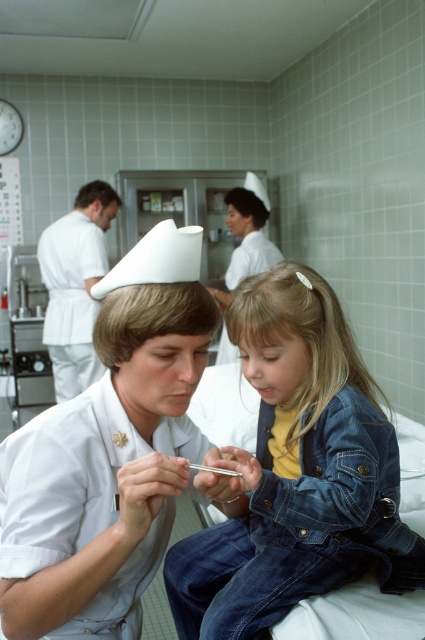
Question: Is denim jacket at lower right thinner than white uniform at center?

Choices:
 (A) no
 (B) yes

Answer: (B)

Question: Is faded denim jacket at lower right to the left of white uniform at center from the viewer's perspective?

Choices:
 (A) no
 (B) yes

Answer: (A)

Question: Is denim jacket at lower right positioned in front of white uniform at center?

Choices:
 (A) no
 (B) yes

Answer: (B)

Question: Considering the real-world distances, which object is closest to the white uniform at center?

Choices:
 (A) denim jacket at lower right
 (B) faded denim jacket at lower right

Answer: (B)

Question: Which is nearer to the denim jacket at lower right?

Choices:
 (A) white uniform at center
 (B) faded denim jacket at lower right

Answer: (B)

Question: Which of the following is the farthest from the observer?

Choices:
 (A) (235, 458)
 (B) (265, 208)
 (C) (183, 294)

Answer: (B)